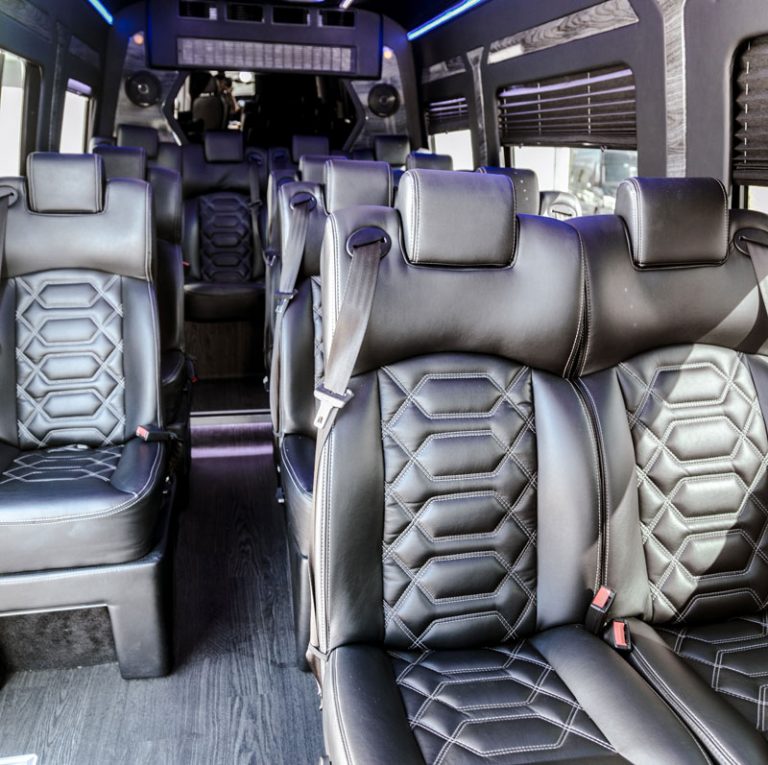
This screenshot has height=765, width=768. In order to click on headrests in this screenshot , I will do `click(462, 210)`, `click(690, 215)`, `click(71, 184)`, `click(133, 155)`, `click(143, 135)`, `click(226, 137)`, `click(310, 145)`, `click(369, 191)`, `click(429, 161)`, `click(388, 145)`.